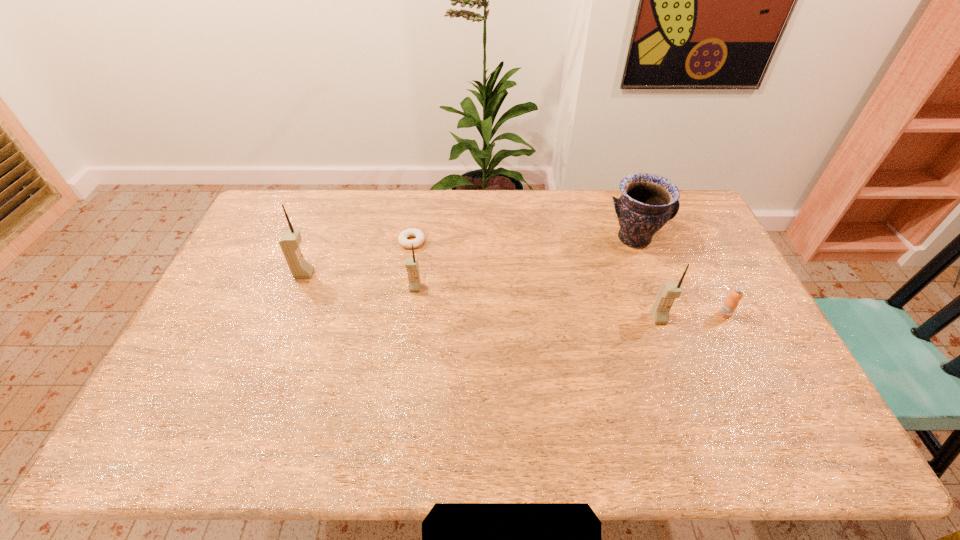
The width and height of the screenshot is (960, 540). What are the coordinates of `vacant space located 0.340m on the front of the farthest cellular telephone, where the keypad is located` in the screenshot? It's located at (420, 274).

The width and height of the screenshot is (960, 540). I want to click on vacant area located 0.130m on the front of the second nearest cellular telephone, where the keypad is located, so click(x=410, y=326).

Identify the location of free space located 0.200m on the front of the second shortest cellular telephone, where the keypad is located. (684, 387).

Locate an element on the screen. The height and width of the screenshot is (540, 960). blank area located on the front of the doughnut is located at coordinates (396, 340).

You are a GUI agent. You are given a task and a screenshot of the screen. Output one action in this format:
    pyautogui.click(x=<x>, y=<y>)
    Task: Click on the vacant space situated on the front handle of the pottery
    
    Given the screenshot: What is the action you would take?
    pyautogui.click(x=650, y=283)

Find the location of `free space located 0.160m on the front label of the second shortest object`. free space located 0.160m on the front label of the second shortest object is located at coordinates point(751,366).

Image resolution: width=960 pixels, height=540 pixels. I want to click on object that is at the far edge, so click(x=648, y=201).

Find the location of a particular element. object located at the right edge is located at coordinates (730, 304).

The width and height of the screenshot is (960, 540). I want to click on vacant space at the far edge, so click(369, 222).

Where is `vacant region at the near edge`? The height and width of the screenshot is (540, 960). vacant region at the near edge is located at coordinates (478, 400).